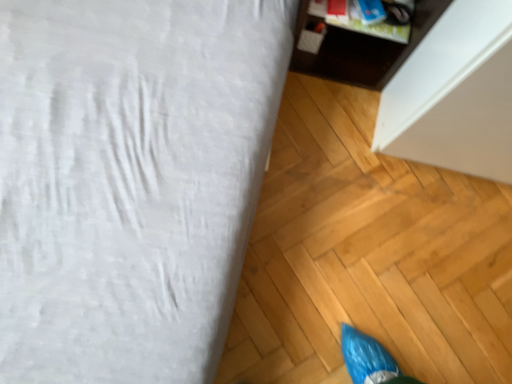
Question: Considering the relative sizes of dark wood cabinet at upper right, the 2th furniture when ordered from left to right, and white fabric bed at upper left, which appears as the 2th furniture when viewed from the right, in the image provided, is dark wood cabinet at upper right, the 2th furniture when ordered from left to right, smaller than white fabric bed at upper left, which appears as the 2th furniture when viewed from the right,?

Choices:
 (A) no
 (B) yes

Answer: (B)

Question: Is the depth of dark wood cabinet at upper right, the 2th furniture when ordered from left to right, greater than that of white fabric bed at upper left, the first furniture positioned from the left?

Choices:
 (A) yes
 (B) no

Answer: (A)

Question: Is dark wood cabinet at upper right, which is the first furniture from right to left, wider than white fabric bed at upper left, which appears as the 2th furniture when viewed from the right?

Choices:
 (A) no
 (B) yes

Answer: (A)

Question: Can you see dark wood cabinet at upper right, the 2th furniture when ordered from left to right, touching white fabric bed at upper left, the first furniture positioned from the left?

Choices:
 (A) yes
 (B) no

Answer: (B)

Question: Are dark wood cabinet at upper right, the 2th furniture when ordered from left to right, and white fabric bed at upper left, the first furniture positioned from the left, located far from each other?

Choices:
 (A) yes
 (B) no

Answer: (B)

Question: Can you confirm if dark wood cabinet at upper right, the 2th furniture when ordered from left to right, is shorter than white fabric bed at upper left, the first furniture positioned from the left?

Choices:
 (A) yes
 (B) no

Answer: (B)

Question: From the image's perspective, is white fabric bed at upper left, which appears as the 2th furniture when viewed from the right, on dark wood cabinet at upper right, the 2th furniture when ordered from left to right?

Choices:
 (A) yes
 (B) no

Answer: (B)

Question: Is the surface of white fabric bed at upper left, the first furniture positioned from the left, in direct contact with dark wood cabinet at upper right, which is the first furniture from right to left?

Choices:
 (A) no
 (B) yes

Answer: (A)

Question: Does white fabric bed at upper left, the first furniture positioned from the left, appear on the left side of dark wood cabinet at upper right, the 2th furniture when ordered from left to right?

Choices:
 (A) no
 (B) yes

Answer: (B)

Question: From a real-world perspective, is white fabric bed at upper left, the first furniture positioned from the left, below dark wood cabinet at upper right, which is the first furniture from right to left?

Choices:
 (A) yes
 (B) no

Answer: (A)

Question: Is white fabric bed at upper left, the first furniture positioned from the left, taller than dark wood cabinet at upper right, the 2th furniture when ordered from left to right?

Choices:
 (A) no
 (B) yes

Answer: (A)

Question: Is white fabric bed at upper left, which appears as the 2th furniture when viewed from the right, thinner than dark wood cabinet at upper right, the 2th furniture when ordered from left to right?

Choices:
 (A) no
 (B) yes

Answer: (A)

Question: Based on their positions, is dark wood cabinet at upper right, which is the first furniture from right to left, located to the left or right of white fabric bed at upper left, the first furniture positioned from the left?

Choices:
 (A) left
 (B) right

Answer: (B)